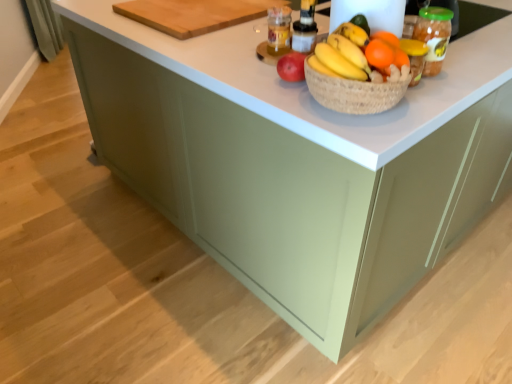
The width and height of the screenshot is (512, 384). Describe the element at coordinates (279, 30) in the screenshot. I see `translucent plastic bottle at upper center` at that location.

Where is `orange matte at upper right`? Image resolution: width=512 pixels, height=384 pixels. orange matte at upper right is located at coordinates (379, 54).

Locate an element on the screen. The image size is (512, 384). wooden cutting board at upper center is located at coordinates (195, 14).

The image size is (512, 384). What are the coordinates of `translucent plastic bottle at upper center` in the screenshot? It's located at (279, 30).

How different are the orientations of orange matte grapefruit at center and orange matte at upper right in degrees?

There is a 180-degree angle between the facing directions of orange matte grapefruit at center and orange matte at upper right.

Does orange matte grapefruit at center have a greater height compared to orange matte at upper right?

Yes.

Considering the points (347, 50) and (368, 59), which point is behind, point (347, 50) or point (368, 59)?

Point (347, 50)

Considering the sizes of orange matte grapefruit at center and orange matte at upper right in the image, is orange matte grapefruit at center wider or thinner than orange matte at upper right?

Clearly, orange matte grapefruit at center has more width compared to orange matte at upper right.

Is translucent plastic bottle at upper center positioned beyond the bounds of wooden cutting board at upper center?

Yes, translucent plastic bottle at upper center is not within wooden cutting board at upper center.

Is translucent plastic bottle at upper center bigger than wooden cutting board at upper center?

No.

Does translucent plastic bottle at upper center appear on the right side of wooden cutting board at upper center?

Correct, you'll find translucent plastic bottle at upper center to the right of wooden cutting board at upper center.

Does translucent plastic bottle at upper center have a greater width compared to wooden cutting board at upper center?

In fact, translucent plastic bottle at upper center might be narrower than wooden cutting board at upper center.

From the image's perspective, which one is positioned higher, orange matte grapefruit at center or wooden cutting board at upper center?

From the image's view, wooden cutting board at upper center is above.

In the scene shown: From a real-world perspective, is orange matte grapefruit at center below wooden cutting board at upper center?

Incorrect, from a real-world perspective, orange matte grapefruit at center is higher than wooden cutting board at upper center.

Considering the sizes of objects orange matte grapefruit at center and wooden cutting board at upper center in the image provided, who is bigger, orange matte grapefruit at center or wooden cutting board at upper center?

wooden cutting board at upper center.

Is point (332, 60) positioned after point (145, 20)?

No, it is not.

Could you tell me if orange matte at upper right is facing translucent plastic bottle at upper center?

No, orange matte at upper right is not aimed at translucent plastic bottle at upper center.

From a real-world perspective, is orange matte at upper right above or below translucent plastic bottle at upper center?

From a real-world perspective, orange matte at upper right is physically above translucent plastic bottle at upper center.

Is orange matte at upper right inside or outside of translucent plastic bottle at upper center?

orange matte at upper right lies outside translucent plastic bottle at upper center.

Between orange matte grapefruit at center and translucent plastic bottle at upper center, which one is positioned behind?

translucent plastic bottle at upper center is more distant.

Does orange matte grapefruit at center have a larger size compared to translucent plastic bottle at upper center?

Correct, orange matte grapefruit at center is larger in size than translucent plastic bottle at upper center.

Identify the location of bottle located underneath the orange matte grapefruit at center (from a real-world perspective). (279, 30).

Considering the sizes of objects orange matte grapefruit at center and translucent plastic bottle at upper center in the image provided, who is wider, orange matte grapefruit at center or translucent plastic bottle at upper center?

orange matte grapefruit at center.

Which is correct: wooden cutting board at upper center is inside orange matte at upper right, or outside of it?

wooden cutting board at upper center is not inside orange matte at upper right, it's outside.

Is wooden cutting board at upper center touching orange matte at upper right?

There is a gap between wooden cutting board at upper center and orange matte at upper right.

Between wooden cutting board at upper center and orange matte at upper right, which one has smaller size?

Smaller between the two is orange matte at upper right.

In the image, there is a wooden cutting board at upper center. At what (x,y) coordinates should I click in order to perform the action: click on orange below it (from the image's perspective). Please return your answer as a coordinate pair (x, y). Looking at the image, I should click on (379, 54).

Relative to translucent plastic bottle at upper center, is wooden cutting board at upper center in front or behind?

wooden cutting board at upper center is positioned farther from the viewer than translucent plastic bottle at upper center.

Based on the photo, from the image's perspective, does wooden cutting board at upper center appear lower than translucent plastic bottle at upper center?

No, from the image's perspective, wooden cutting board at upper center is not below translucent plastic bottle at upper center.

Is point (162, 1) positioned after point (269, 52)?

That is True.

Is wooden cutting board at upper center wider than translucent plastic bottle at upper center?

Correct, the width of wooden cutting board at upper center exceeds that of translucent plastic bottle at upper center.

Find the location of a particular element. grapefruit that is in front of the orange matte at upper right is located at coordinates (361, 55).

Find the location of `bottle on the right of wooden cutting board at upper center`. bottle on the right of wooden cutting board at upper center is located at coordinates (279, 30).

Looking at the image, which one is located further to translucent plastic bottle at upper center, orange matte at upper right or wooden cutting board at upper center?

Based on the image, orange matte at upper right appears to be further to translucent plastic bottle at upper center.

Estimate the real-world distances between objects in this image. Which object is further from wooden cutting board at upper center, translucent plastic bottle at upper center or orange matte at upper right?

orange matte at upper right is positioned further to the anchor wooden cutting board at upper center.

When comparing their distances from orange matte at upper right, does wooden cutting board at upper center or orange matte grapefruit at center seem further?

The object further to orange matte at upper right is wooden cutting board at upper center.

Estimate the real-world distances between objects in this image. Which object is closer to wooden cutting board at upper center, orange matte at upper right or translucent plastic bottle at upper center?

translucent plastic bottle at upper center is positioned closer to the anchor wooden cutting board at upper center.

From the image, which object appears to be nearer to wooden cutting board at upper center, orange matte grapefruit at center or translucent plastic bottle at upper center?

translucent plastic bottle at upper center is closer to wooden cutting board at upper center.

Estimate the real-world distances between objects in this image. Which object is further from translucent plastic bottle at upper center, orange matte at upper right or orange matte grapefruit at center?

Based on the image, orange matte at upper right appears to be further to translucent plastic bottle at upper center.

When comparing their distances from translucent plastic bottle at upper center, does orange matte grapefruit at center or orange matte at upper right seem closer?

orange matte grapefruit at center is closer to translucent plastic bottle at upper center.

Based on their spatial positions, is wooden cutting board at upper center or orange matte at upper right further from orange matte grapefruit at center?

Based on the image, wooden cutting board at upper center appears to be further to orange matte grapefruit at center.

At what (x,y) coordinates should I click in order to perform the action: click on bottle between wooden cutting board at upper center and orange matte at upper right. Please return your answer as a coordinate pair (x, y). Image resolution: width=512 pixels, height=384 pixels. Looking at the image, I should click on (279, 30).

This screenshot has height=384, width=512. I want to click on orange between orange matte grapefruit at center and wooden cutting board at upper center in the front-back direction, so click(x=379, y=54).

This screenshot has height=384, width=512. Find the location of `bottle between orange matte grapefruit at center and wooden cutting board at upper center along the z-axis`. bottle between orange matte grapefruit at center and wooden cutting board at upper center along the z-axis is located at coordinates (279, 30).

The image size is (512, 384). I want to click on orange between orange matte grapefruit at center and translucent plastic bottle at upper center in the front-back direction, so click(379, 54).